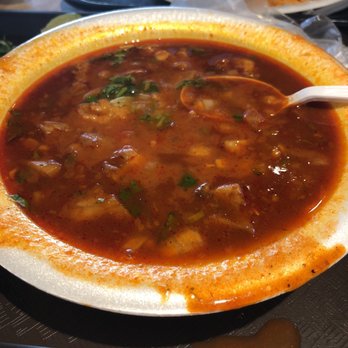
Locate an element on the screen. paper plate is located at coordinates (x=131, y=315).